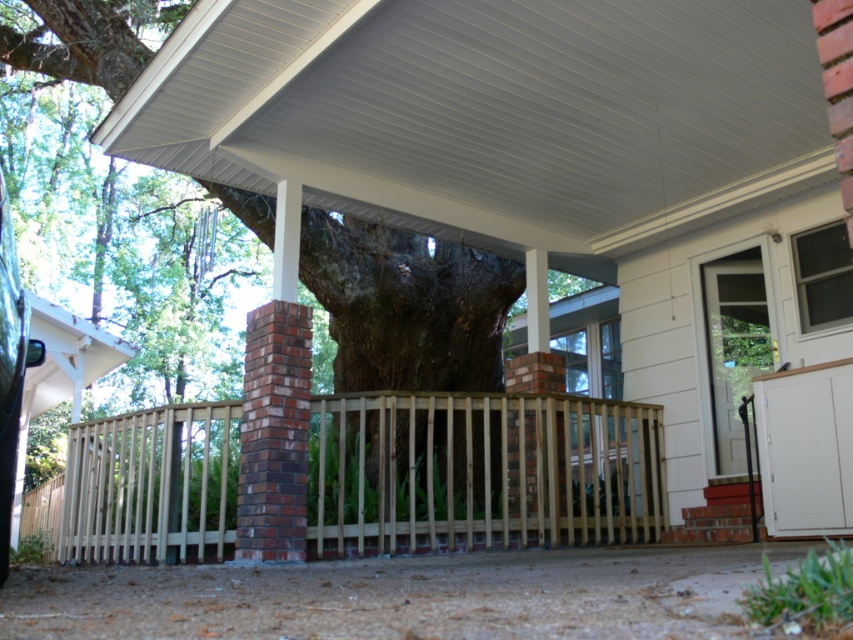
You are standing on the porch and want to hang a bird feeder. You see the white corrugated metal roof at upper center and the light brown wooden fence at center. Which object is higher from the ground?

The white corrugated metal roof at upper center is above the light brown wooden fence at center, so the white corrugated metal roof at upper center is higher from the ground.

You are a painter who needs to paint both the white corrugated metal roof at upper center and the light brown wooden fence at center. Which object is shorter and requires less ladder height?

The white corrugated metal roof at upper center is shorter than the light brown wooden fence at center, so it requires less ladder height.

Based on the photo, you are standing on the porch and want to place a bird feeder exactly at the center of the white corrugated metal roof at upper center. According to the coordinates provided, what are the exact coordinates where you should place it?

The exact coordinates for placing the bird feeder at the center of the white corrugated metal roof at upper center are 0.178 in the x axis and 0.579 in the y axis.